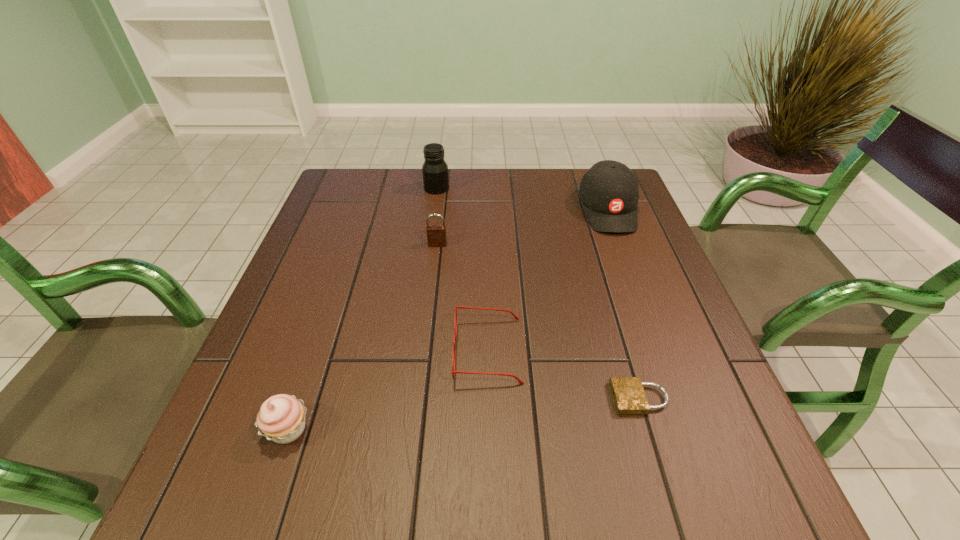
I want to click on baseball cap that is positioned at the far edge, so click(609, 191).

At what (x,y) coordinates should I click in order to perform the action: click on object situated at the left edge. Please return your answer as a coordinate pair (x, y). This screenshot has width=960, height=540. Looking at the image, I should click on (281, 418).

At what (x,y) coordinates should I click in order to perform the action: click on baseball cap located at the right edge. Please return your answer as a coordinate pair (x, y). Looking at the image, I should click on 609,191.

Where is `padlock that is at the right edge`? This screenshot has height=540, width=960. padlock that is at the right edge is located at coordinates (629, 397).

Identify the location of object that is at the far right corner. The width and height of the screenshot is (960, 540). (609, 191).

The width and height of the screenshot is (960, 540). In order to click on vacant space at the far edge of the desktop in this screenshot , I will do tap(414, 199).

Locate an element on the screen. This screenshot has width=960, height=540. vacant area at the near edge is located at coordinates (382, 494).

You are a GUI agent. You are given a task and a screenshot of the screen. Output one action in this format:
    pyautogui.click(x=<x>, y=<y>)
    Task: Click on the vacant region at the left edge of the desktop
    The image size is (960, 540).
    Given the screenshot: What is the action you would take?
    pyautogui.click(x=325, y=219)

Locate an element on the screen. free space at the right edge of the desktop is located at coordinates 666,317.

This screenshot has width=960, height=540. Identify the location of free space at the far left corner of the desktop. (358, 200).